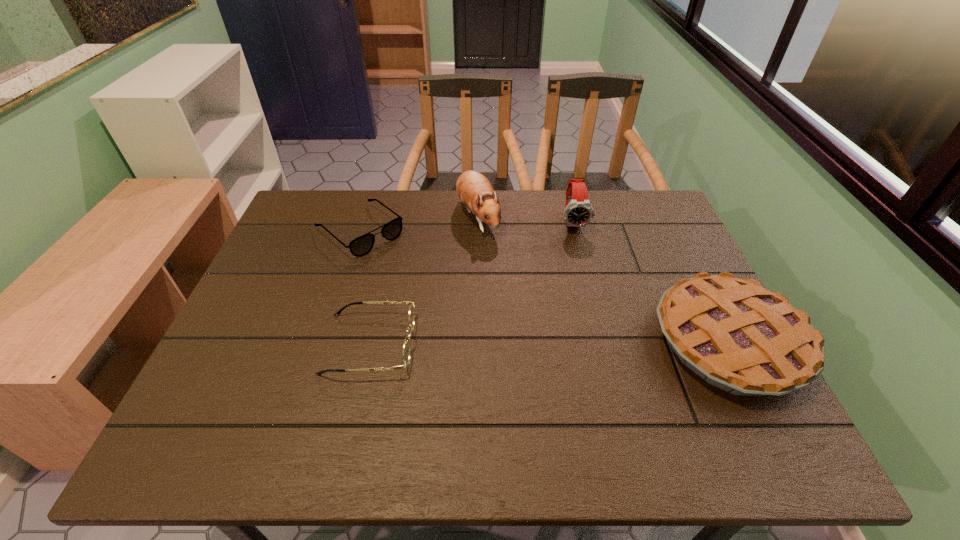
Locate an element on the screen. pie situated at the near edge is located at coordinates (738, 336).

Where is `object that is at the left edge`? This screenshot has height=540, width=960. object that is at the left edge is located at coordinates (360, 246).

Where is `object located at the right edge`? This screenshot has width=960, height=540. object located at the right edge is located at coordinates (738, 336).

Locate an element on the screen. This screenshot has width=960, height=540. object at the far left corner is located at coordinates (360, 246).

The height and width of the screenshot is (540, 960). Find the location of `object at the near right corner`. object at the near right corner is located at coordinates (738, 336).

In the image, there is a desktop. Identify the location of vacant space at the far edge. (419, 230).

This screenshot has width=960, height=540. I want to click on free spot at the near edge of the desktop, so click(461, 389).

The height and width of the screenshot is (540, 960). What are the coordinates of `vacant area at the left edge` in the screenshot? It's located at (243, 305).

What are the coordinates of `vacant region at the far left corner of the desktop` in the screenshot? It's located at (332, 200).

Image resolution: width=960 pixels, height=540 pixels. I want to click on unoccupied position between the nearer spectacles and the third object from right to left, so click(423, 280).